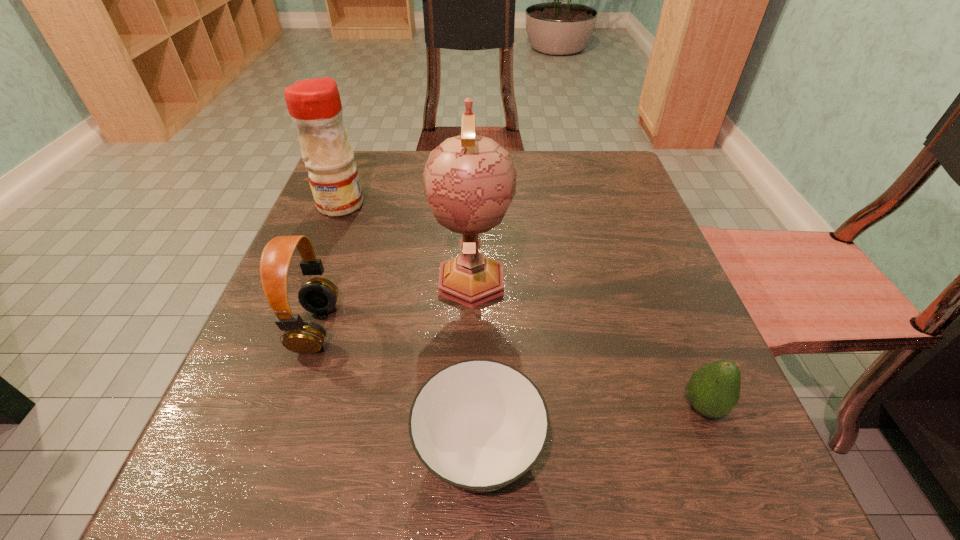
You are a GUI agent. You are given a task and a screenshot of the screen. Output one action in this format:
    pyautogui.click(x=<x>, y=<y>)
    Task: Click on the blank area at the far left corner
    The width and height of the screenshot is (960, 540).
    Given the screenshot: What is the action you would take?
    pyautogui.click(x=362, y=156)

Identify the location of free space at the far right corner of the desktop. (570, 180).

In the image, there is a desktop. Identify the location of free space at the near right corner. This screenshot has height=540, width=960. (727, 505).

Where is `free space between the soup bowl and the second tallest object`? This screenshot has width=960, height=540. free space between the soup bowl and the second tallest object is located at coordinates coord(410,328).

The height and width of the screenshot is (540, 960). Identify the location of unoccupied position between the third tallest object and the tallest object. (394, 303).

At what (x,y) coordinates should I click in order to perform the action: click on vacant area that lies between the tallest object and the avocado. Please return your answer as a coordinate pair (x, y). The height and width of the screenshot is (540, 960). Looking at the image, I should click on (588, 342).

Where is `vacant space that's between the headset and the soup bowl`? This screenshot has height=540, width=960. vacant space that's between the headset and the soup bowl is located at coordinates (397, 390).

At what (x,y) coordinates should I click in order to perform the action: click on free space between the fourth shortest object and the rightmost object. Please return your answer as a coordinate pair (x, y). Looking at the image, I should click on (522, 305).

Image resolution: width=960 pixels, height=540 pixels. In order to click on vacant area between the rightmost object and the globe in this screenshot , I will do `click(588, 342)`.

Where is `vacant space that is in between the headset and the tallest object`? The image size is (960, 540). vacant space that is in between the headset and the tallest object is located at coordinates (394, 303).